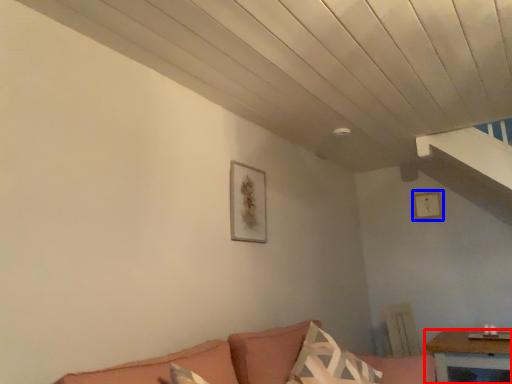
Question: Which object is further to the camera taking this photo, table (highlighted by a red box) or picture frame (highlighted by a blue box)?

Choices:
 (A) table
 (B) picture frame

Answer: (B)